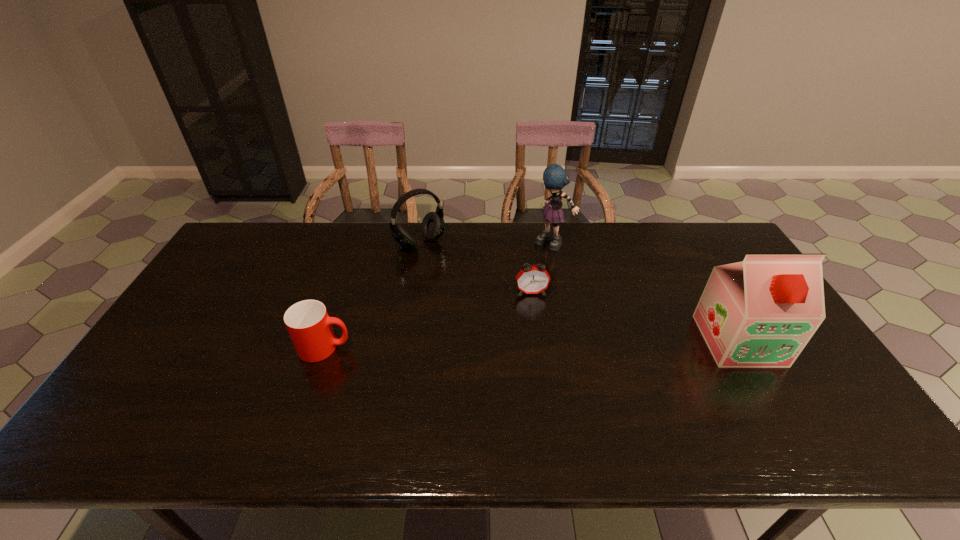
This screenshot has width=960, height=540. I want to click on vacant space on the desktop that is between the cup and the rightmost object and is positioned on the ear cups of the headset, so click(521, 345).

Locate an element on the screen. This screenshot has height=540, width=960. free spot on the desktop that is between the leftmost object and the soya milk and is positioned on the front-facing side of the rag doll is located at coordinates (492, 345).

You are a GUI agent. You are given a task and a screenshot of the screen. Output one action in this format:
    pyautogui.click(x=<x>, y=<y>)
    Task: Click on the free space on the desktop that is between the leftmost object and the rightmost object and is positioned on the clock face of the alarm clock
    This screenshot has width=960, height=540.
    Given the screenshot: What is the action you would take?
    pyautogui.click(x=540, y=344)